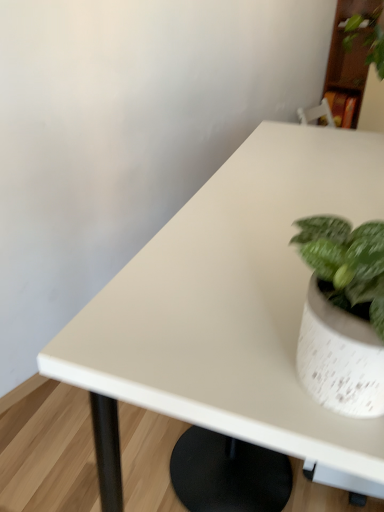
Describe the element at coordinates (228, 308) in the screenshot. This screenshot has width=384, height=512. I see `white matte table at upper right` at that location.

Locate an element on the screen. The image size is (384, 512). white matte table at upper right is located at coordinates (228, 308).

Locate an element on the screen. Image resolution: width=384 pixels, height=512 pixels. white matte table at upper right is located at coordinates (228, 308).